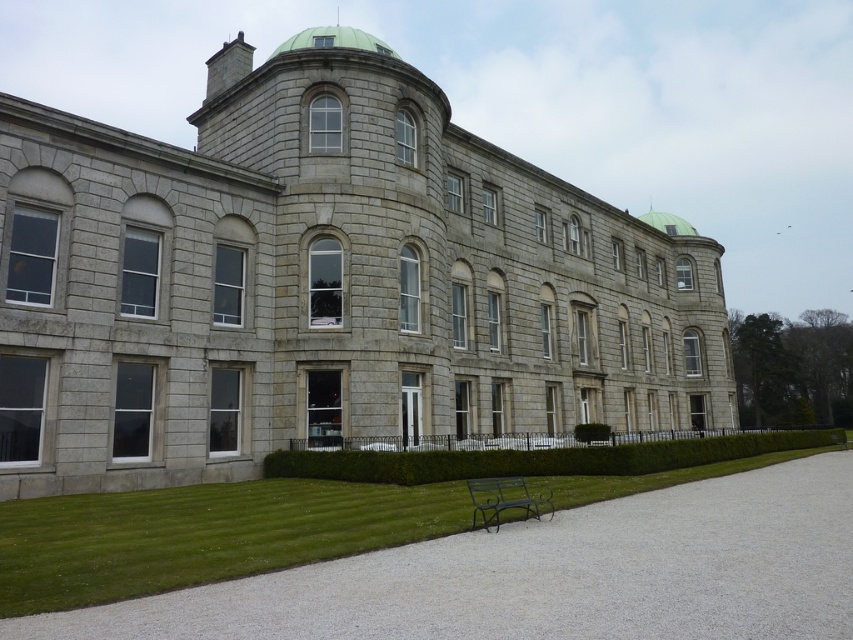
Question: Does green grass at lower left have a larger size compared to metallic green bench at lower center?

Choices:
 (A) no
 (B) yes

Answer: (B)

Question: Which is farther from the green leafy hedge at lower center?

Choices:
 (A) green leafy hedge at center
 (B) metallic green bench at lower center
 (C) green grass at lower left

Answer: (C)

Question: Which point is farther from the camera taking this photo?

Choices:
 (A) (473, 492)
 (B) (515, 456)
 (C) (19, 509)

Answer: (B)

Question: Does metallic green bench at lower center appear on the left side of green leafy hedge at lower center?

Choices:
 (A) yes
 (B) no

Answer: (A)

Question: Does green leafy hedge at center have a smaller size compared to metallic green bench at lower center?

Choices:
 (A) yes
 (B) no

Answer: (B)

Question: Which object is the closest to the metallic green bench at lower center?

Choices:
 (A) green leafy hedge at lower center
 (B) green grass at lower left

Answer: (B)